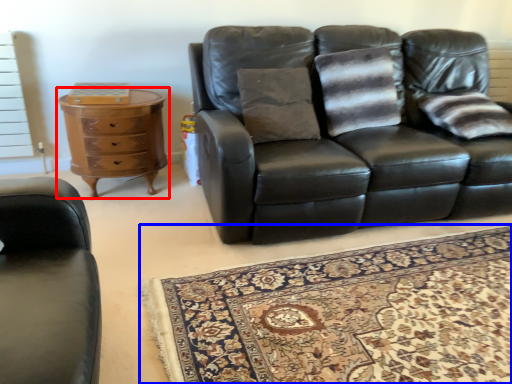
Question: Which point is further to the camera, chest of drawers (highlighted by a red box) or mat (highlighted by a blue box)?

Choices:
 (A) chest of drawers
 (B) mat

Answer: (A)